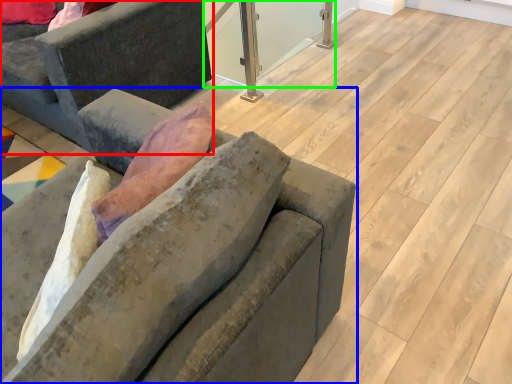
Question: Which is farther away from studio couch (highlighted by a red box)? studio couch (highlighted by a blue box) or window screen (highlighted by a green box)?

Choices:
 (A) studio couch
 (B) window screen

Answer: (B)